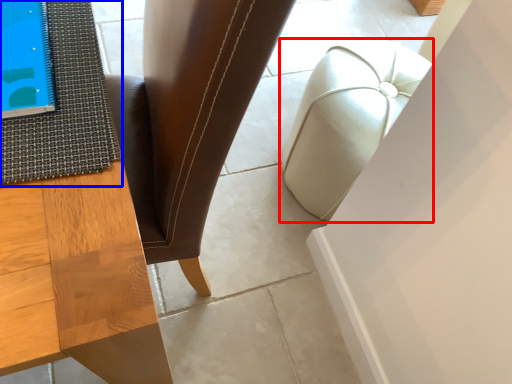
Question: Which point is closer to the camera, furniture (highlighted by a red box) or mat (highlighted by a blue box)?

Choices:
 (A) furniture
 (B) mat

Answer: (B)